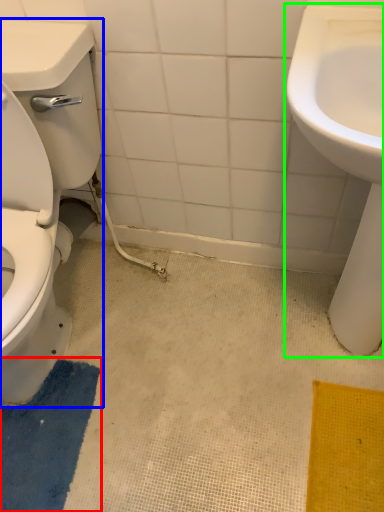
Question: Based on their relative distances, which object is nearer to bath mat (highlighted by a red box)? Choose from porcelain (highlighted by a blue box) and sink (highlighted by a green box).

Choices:
 (A) porcelain
 (B) sink

Answer: (A)